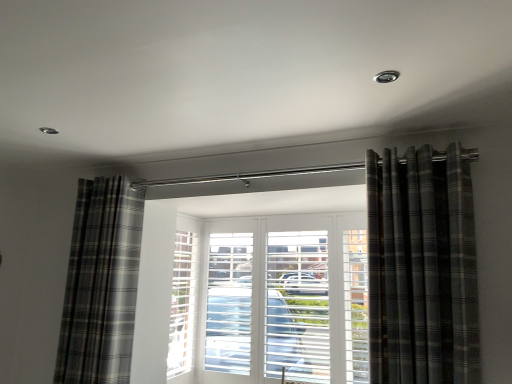
Question: From the image's perspective, is plaid fabric curtain at left, which appears as the 1th curtain when viewed from the back, located above or below plaid fabric curtain at right, which is counted as the 2th curtain, starting from the left?

Choices:
 (A) above
 (B) below

Answer: (B)

Question: Is plaid fabric curtain at left, which appears as the 1th curtain when viewed from the back, inside the boundaries of plaid fabric curtain at right, which is counted as the 2th curtain, starting from the left, or outside?

Choices:
 (A) inside
 (B) outside

Answer: (B)

Question: Considering the positions of plaid fabric curtain at left, positioned as the second curtain in front-to-back order, and plaid fabric curtain at right, which appears as the first curtain when viewed from the right, in the image, is plaid fabric curtain at left, positioned as the second curtain in front-to-back order, wider or thinner than plaid fabric curtain at right, which appears as the first curtain when viewed from the right,?

Choices:
 (A) wide
 (B) thin

Answer: (A)

Question: From a real-world perspective, relative to plaid fabric curtain at left, the 2th curtain in the right-to-left sequence, is plaid fabric curtain at right, which is counted as the 2th curtain, starting from the left, vertically above or below?

Choices:
 (A) above
 (B) below

Answer: (A)

Question: Is plaid fabric curtain at right, which is counted as the 2th curtain, starting from the left, wider or thinner than plaid fabric curtain at left, which appears as the 1th curtain when viewed from the back?

Choices:
 (A) thin
 (B) wide

Answer: (A)

Question: Is point (399, 226) closer or farther from the camera than point (73, 327)?

Choices:
 (A) closer
 (B) farther

Answer: (A)

Question: Is plaid fabric curtain at right, which appears as the 1th curtain when viewed from the front, to the left or to the right of plaid fabric curtain at left, which is counted as the first curtain, starting from the left, in the image?

Choices:
 (A) right
 (B) left

Answer: (A)